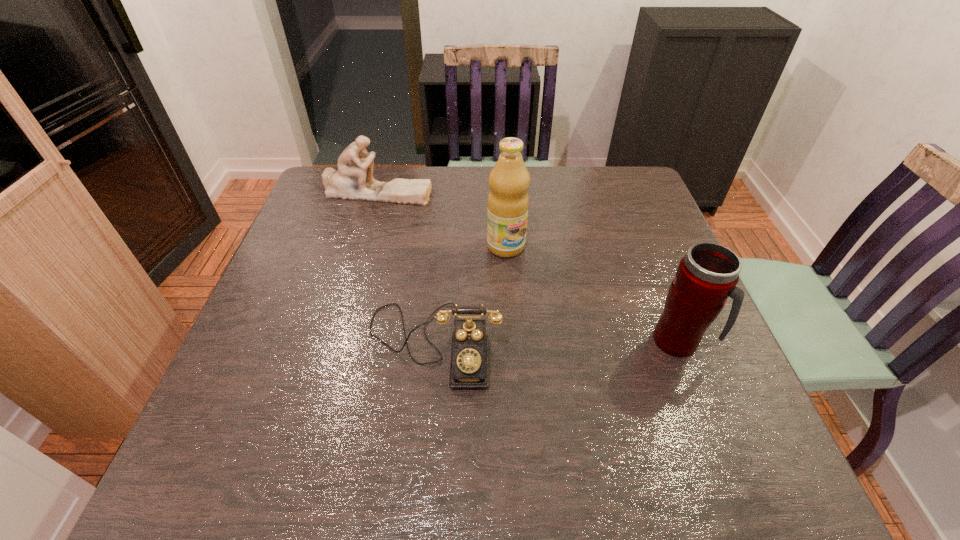
You are a GUI agent. You are given a task and a screenshot of the screen. Output one action in this format:
    pyautogui.click(x=<x>, y=<y>)
    Task: Click on the free space located on the front-facing side of the farthest object
    
    Given the screenshot: What is the action you would take?
    pyautogui.click(x=420, y=212)

Find the location of a particular element. The height and width of the screenshot is (540, 960). vacant space located 0.250m on the front-facing side of the farthest object is located at coordinates (458, 246).

Find the location of a particular element. This screenshot has height=540, width=960. free region located 0.390m on the front-facing side of the farthest object is located at coordinates (492, 275).

The height and width of the screenshot is (540, 960). In order to click on object present at the far edge in this screenshot , I will do `click(354, 180)`.

The image size is (960, 540). I want to click on object located in the near edge section of the desktop, so click(469, 368).

Image resolution: width=960 pixels, height=540 pixels. In order to click on object positioned at the left edge in this screenshot , I will do coord(354,180).

Where is `object that is positioned at the right edge`? object that is positioned at the right edge is located at coordinates (707, 275).

Find the location of a particular element. This screenshot has width=960, height=540. object located at the far left corner is located at coordinates (354, 180).

Where is `vacant region at the far edge of the desktop`? vacant region at the far edge of the desktop is located at coordinates (418, 167).

Find the location of `vacant area at the near edge of the desktop`. vacant area at the near edge of the desktop is located at coordinates (540, 405).